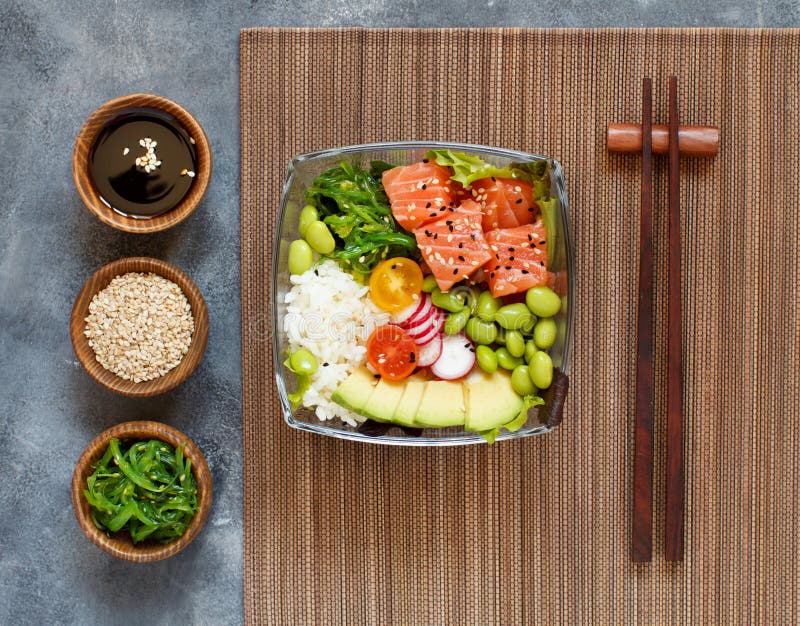
The image size is (800, 626). I want to click on chop sticks, so click(x=673, y=526), click(x=646, y=524).